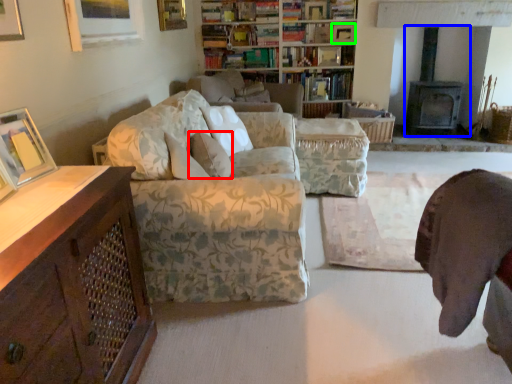
Question: Which object is positioned farthest from pillow (highlighted by a red box)? Select from fireplace (highlighted by a blue box) and picture frame (highlighted by a green box).

Choices:
 (A) fireplace
 (B) picture frame

Answer: (A)